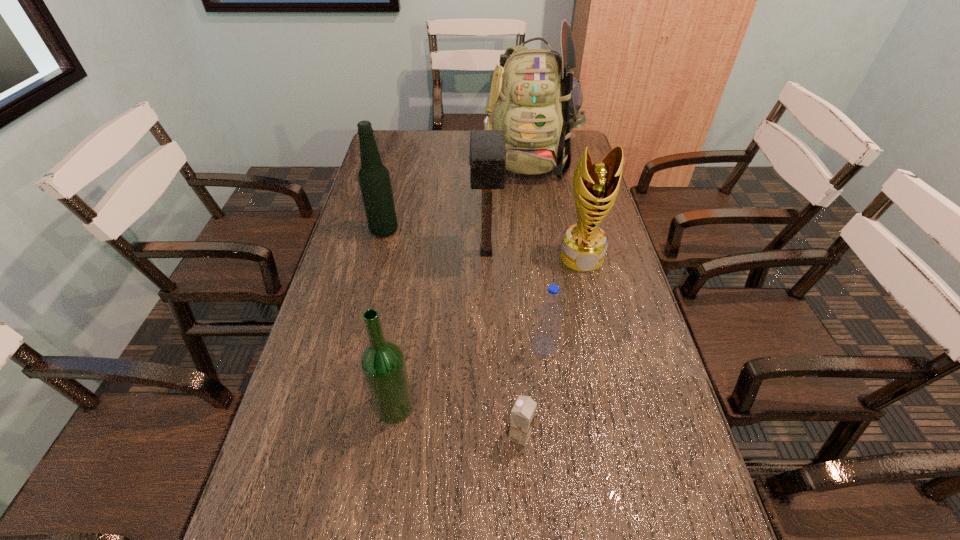
Identify the location of the farthest object. (535, 99).

Identify the location of the tallest object. pyautogui.click(x=535, y=99).

I want to click on mallet, so click(487, 158).

At what (x,y) coordinates should I click in order to perform the action: click on the left alcohol. Please return your answer as a coordinate pair (x, y). Looking at the image, I should click on (374, 179).

At what (x,y) coordinates should I click in order to perform the action: click on the farther alcohol. Please return your answer as a coordinate pair (x, y). This screenshot has width=960, height=540. Looking at the image, I should click on (374, 179).

Identify the location of award. The width and height of the screenshot is (960, 540). (595, 186).

This screenshot has width=960, height=540. What are the coordinates of `the nearer alcohol` in the screenshot? It's located at (382, 362).

The width and height of the screenshot is (960, 540). Find the location of `the right alcohol`. the right alcohol is located at coordinates (382, 362).

Identify the location of the third nearest object. Image resolution: width=960 pixels, height=540 pixels. (547, 326).

You are a GUI agent. You are given a task and a screenshot of the screen. Output one action in this format:
    pyautogui.click(x=<x>, y=<y>)
    Task: Click on the sixth tallest object
    The image size is (960, 540).
    Given the screenshot: What is the action you would take?
    pyautogui.click(x=547, y=326)